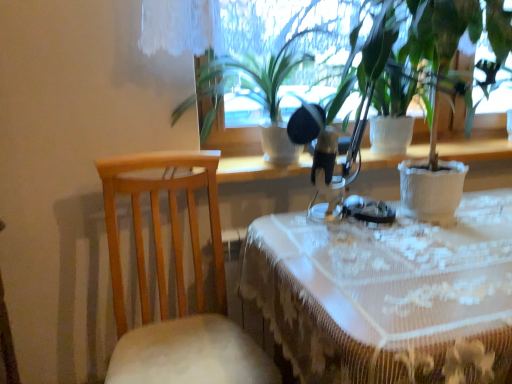
Question: Considering the positions of white textured pot at center, marked as the second houseplant in a left-to-right arrangement, and green matte plant at center, which appears as the 2th houseplant when viewed from the right, in the image, is white textured pot at center, marked as the second houseplant in a left-to-right arrangement, taller or shorter than green matte plant at center, which appears as the 2th houseplant when viewed from the right,?

Choices:
 (A) short
 (B) tall

Answer: (B)

Question: Looking at their shapes, would you say white textured pot at center, marked as the second houseplant in a left-to-right arrangement, is wider or thinner than green matte plant at center, which appears as the 2th houseplant when viewed from the right?

Choices:
 (A) wide
 (B) thin

Answer: (B)

Question: Which object is the farthest from the light wood chair at left?

Choices:
 (A) white lace tablecloth at center
 (B) green matte plant at center, the 1th houseplant when ordered from left to right
 (C) white textured pot at center, placed as the first houseplant when sorted from right to left

Answer: (C)

Question: Which object is the farthest from the light wood chair at left?

Choices:
 (A) green matte plant at center, which appears as the 2th houseplant when viewed from the right
 (B) white textured pot at center, placed as the first houseplant when sorted from right to left
 (C) white lace tablecloth at center

Answer: (B)